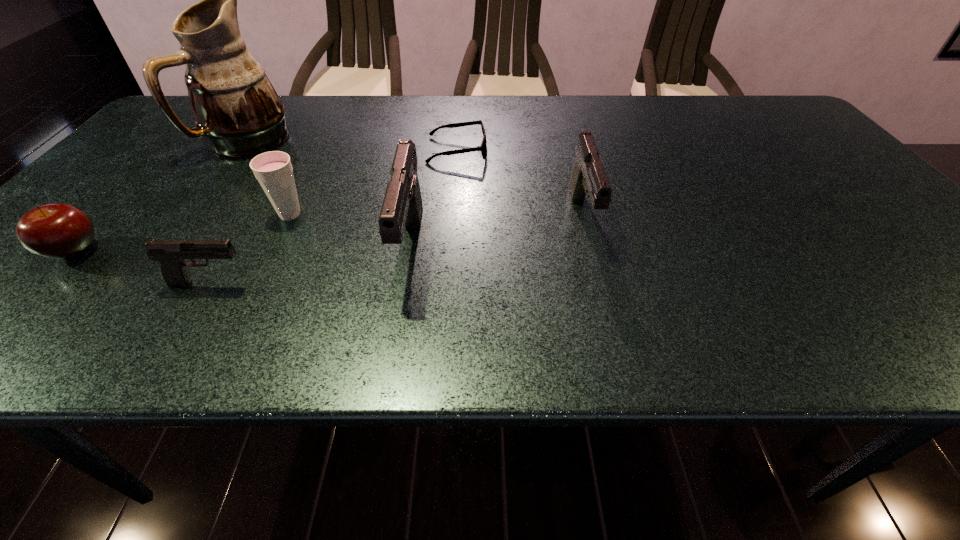
Find the location of a particular element. the shortest pistol is located at coordinates (171, 253).

At what (x,y) coordinates should I click in order to perform the action: click on the second pistol from left to right. Please return your answer as a coordinate pair (x, y). Looking at the image, I should click on (402, 207).

The image size is (960, 540). I want to click on the rightmost object, so click(x=588, y=178).

At what (x,y) coordinates should I click in order to perform the action: click on the second shortest pistol. Please return your answer as a coordinate pair (x, y). The height and width of the screenshot is (540, 960). Looking at the image, I should click on (588, 178).

I want to click on the tallest object, so click(235, 106).

Find the location of a particular element. This screenshot has height=540, width=960. the shortest object is located at coordinates (483, 148).

Where is `the leftmost object`? the leftmost object is located at coordinates (60, 231).

The width and height of the screenshot is (960, 540). I want to click on the fourth shortest object, so click(x=273, y=170).

The width and height of the screenshot is (960, 540). I want to click on vacant region located 0.210m aim along the barrel of the shortest pistol, so click(360, 283).

The width and height of the screenshot is (960, 540). I want to click on vacant space located aim along the barrel of the rightmost pistol, so click(600, 285).